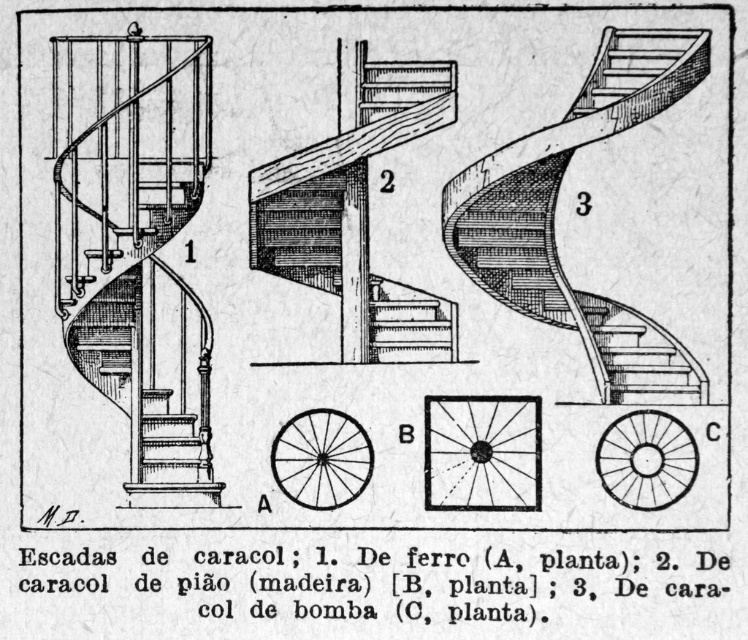
In the left section of the spiral staircase illustration, there is a transparent glass sunburst at center and wooden stairs at center. Which object is positioned higher in the image?

The wooden stairs at center are positioned higher than the transparent glass sunburst at center because the sunburst is located below the stairs.

You are an architect designing a modern building and want to incorporate both a wooden staircase at center and a transparent glass sunburst at center into the lobby. Given their heights, which one would require more vertical space in the lobby design?

Result: The wooden staircase at center is taller than the transparent glass sunburst at center, so it would require more vertical space in the lobby design.